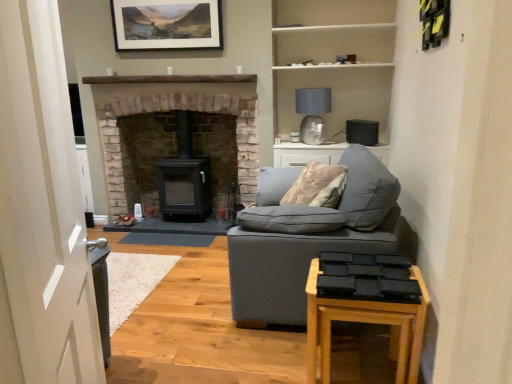
Question: Is matte wooden picture frame at upper center shorter than white matte shelves at upper center?

Choices:
 (A) no
 (B) yes

Answer: (B)

Question: From a real-world perspective, is matte wooden picture frame at upper center over white matte shelves at upper center?

Choices:
 (A) yes
 (B) no

Answer: (A)

Question: Is matte wooden picture frame at upper center placed right next to white matte shelves at upper center?

Choices:
 (A) no
 (B) yes

Answer: (A)

Question: Is matte wooden picture frame at upper center outside of white matte shelves at upper center?

Choices:
 (A) yes
 (B) no

Answer: (A)

Question: Is white matte shelves at upper center inside matte wooden picture frame at upper center?

Choices:
 (A) no
 (B) yes

Answer: (A)

Question: Does matte wooden picture frame at upper center come behind white matte shelves at upper center?

Choices:
 (A) no
 (B) yes

Answer: (B)

Question: Is white glossy door at left beside matte glass lampshade at upper center?

Choices:
 (A) yes
 (B) no

Answer: (B)

Question: Can we say white glossy door at left lies outside matte glass lampshade at upper center?

Choices:
 (A) yes
 (B) no

Answer: (A)

Question: Is the depth of white glossy door at left greater than that of matte glass lampshade at upper center?

Choices:
 (A) no
 (B) yes

Answer: (A)

Question: Is white glossy door at left shorter than matte glass lampshade at upper center?

Choices:
 (A) no
 (B) yes

Answer: (A)

Question: Is white glossy door at left oriented towards matte glass lampshade at upper center?

Choices:
 (A) no
 (B) yes

Answer: (A)

Question: From the image's perspective, does white glossy door at left appear higher than matte glass lampshade at upper center?

Choices:
 (A) yes
 (B) no

Answer: (B)

Question: From a real-world perspective, is white glossy door at left located beneath soft gray fabric couch at center?

Choices:
 (A) yes
 (B) no

Answer: (B)